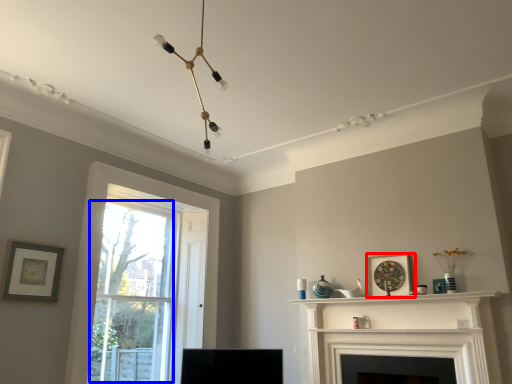
Question: Which of the following is the farthest to the observer, picture frame (highlighted by a red box) or bay window (highlighted by a blue box)?

Choices:
 (A) picture frame
 (B) bay window

Answer: (B)